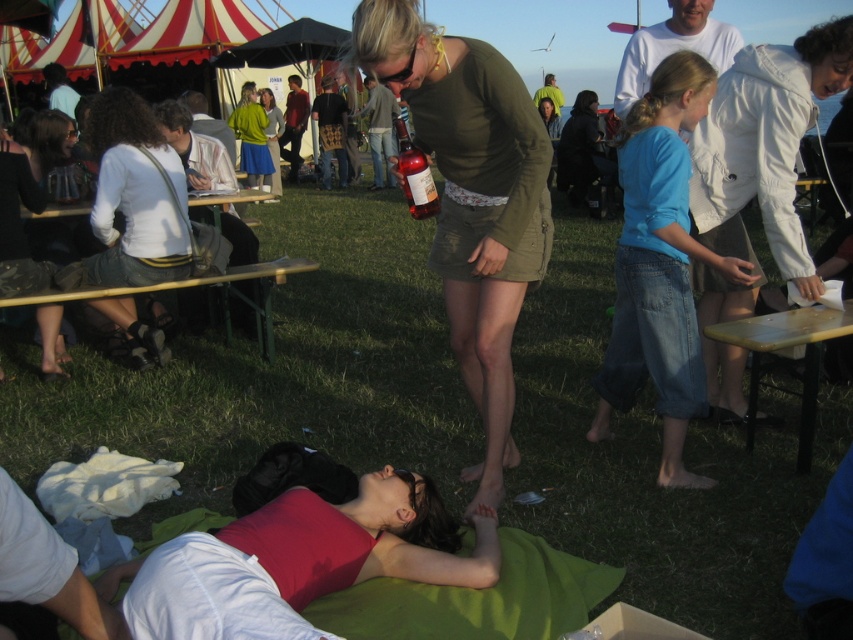
Does white matte jacket at upper right appear on the left side of light brown leather jacket at upper center?

No, white matte jacket at upper right is not to the left of light brown leather jacket at upper center.

Is point (780, 221) farther from viewer compared to point (234, 141)?

No, (780, 221) is closer to viewer.

At what (x,y) coordinates should I click in order to perform the action: click on white matte jacket at upper right. Please return your answer as a coordinate pair (x, y). The height and width of the screenshot is (640, 853). Looking at the image, I should click on (764, 145).

Is the position of matte white shirt at left less distant than that of denim jeans at center?

Yes, it is in front of denim jeans at center.

Is the position of matte white shirt at left more distant than that of denim jeans at center?

No, it is in front of denim jeans at center.

Does point (32, 164) come in front of point (372, 157)?

Yes, point (32, 164) is in front of point (372, 157).

Where is `matte white shirt at left`? matte white shirt at left is located at coordinates (27, 198).

Is point (436, 154) behind point (257, 161)?

No, (436, 154) is closer to viewer.

Which is more to the left, matte green dress at center or green fabric skirt at upper center?

green fabric skirt at upper center

Which is in front, point (531, 220) or point (250, 113)?

Point (531, 220)

Where is `matte green dress at center`? matte green dress at center is located at coordinates (471, 198).